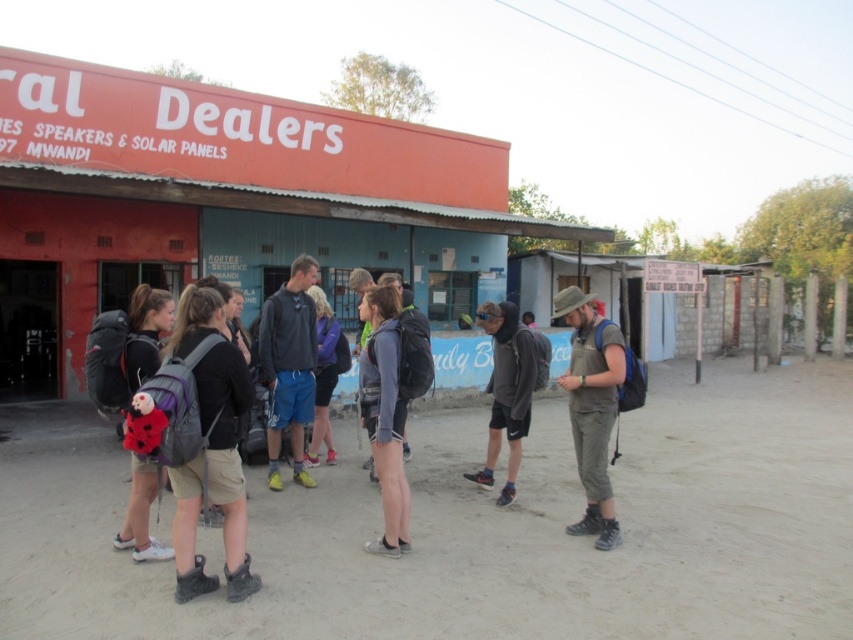
Question: Which object is the closest to the matte khaki pants at center?

Choices:
 (A) purple fabric backpack at center
 (B) matte black backpack at left

Answer: (A)

Question: From the image, what is the correct spatial relationship of matte black backpack at left in relation to purple fabric backpack at center?

Choices:
 (A) left
 (B) right

Answer: (A)

Question: Which object appears closest to the camera in this image?

Choices:
 (A) purple fabric backpack at center
 (B) matte black backpack at center

Answer: (B)

Question: Which of these objects is positioned closest to the matte black backpack at left?

Choices:
 (A) matte khaki pants at center
 (B) gray matte jacket at center
 (C) matte black backpack at center
 (D) blue fabric shorts at center

Answer: (C)

Question: Is matte khaki pants at center above dark gray hoodie at center?

Choices:
 (A) yes
 (B) no

Answer: (A)

Question: Can you confirm if gray matte jacket at center is positioned above purple fabric backpack at center?

Choices:
 (A) yes
 (B) no

Answer: (B)